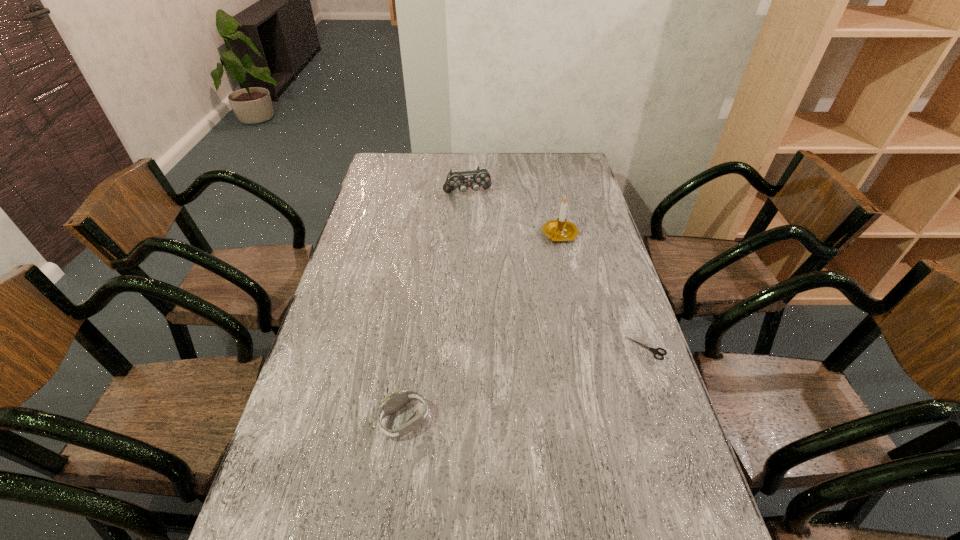
The image size is (960, 540). Find the location of `vacant space located on the left of the shortest object`. vacant space located on the left of the shortest object is located at coordinates (498, 348).

Locate an element on the screen. vacant area situated with a handle on the candle holder is located at coordinates click(x=555, y=330).

Where is `free space located with a handle on the candle holder`? This screenshot has width=960, height=540. free space located with a handle on the candle holder is located at coordinates (559, 261).

Locate an element on the screen. free space located 0.200m with a handle on the candle holder is located at coordinates tap(557, 287).

Find the location of `free space located on the surface of the control with buttons`. free space located on the surface of the control with buttons is located at coordinates [479, 222].

The width and height of the screenshot is (960, 540). Find the location of `free space located 0.090m on the surface of the control with buttons`. free space located 0.090m on the surface of the control with buttons is located at coordinates (476, 213).

At what (x,y) coordinates should I click in order to perform the action: click on vacant area located 0.320m on the surface of the control with buttons. Please return your answer as a coordinate pair (x, y). This screenshot has width=960, height=540. Looking at the image, I should click on (489, 251).

This screenshot has height=540, width=960. What are the coordinates of `shears that is at the right edge` in the screenshot? It's located at (655, 350).

At what (x,y) coordinates should I click in order to perform the action: click on candle holder that is at the right edge. Please return your answer as a coordinate pair (x, y). This screenshot has width=960, height=540. Looking at the image, I should click on (556, 230).

Locate an element on the screen. This screenshot has width=960, height=540. vacant space at the far edge of the desktop is located at coordinates (492, 154).